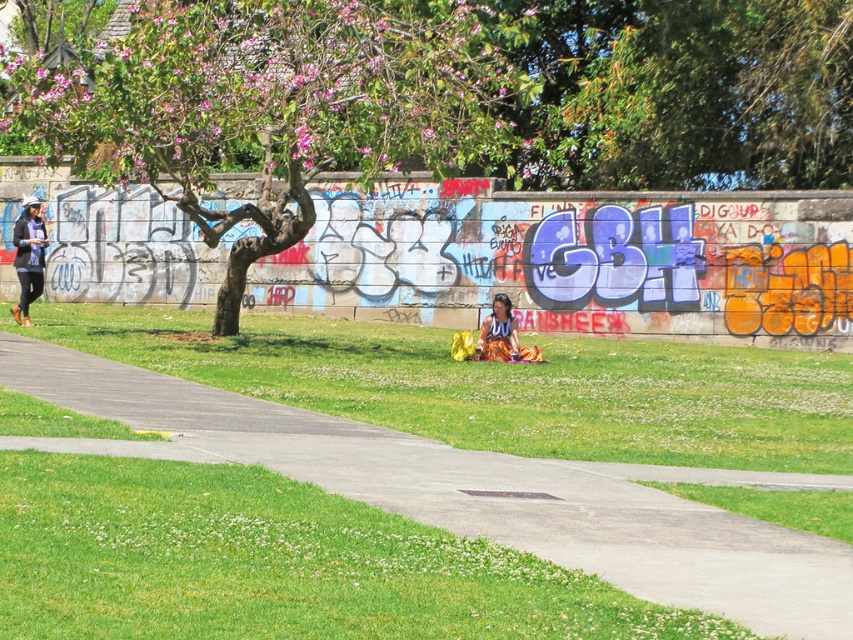
Who is taller, green grass at center or matte black jacket at left?

matte black jacket at left is taller.

The image size is (853, 640). What do you see at coordinates (502, 385) in the screenshot?
I see `green grass at center` at bounding box center [502, 385].

Does point (248, 381) lie in front of point (39, 291)?

That is True.

This screenshot has height=640, width=853. In order to click on green grass at center in this screenshot , I will do `click(502, 385)`.

Is gray concrete pavement at center positioned behind green grass at center?

No, it is in front of green grass at center.

Find the location of a particular element. The image size is (853, 640). gray concrete pavement at center is located at coordinates (474, 490).

Can you confirm if pink flowered tree at upper left is taller than gray concrete pavement at center?

Yes, pink flowered tree at upper left is taller than gray concrete pavement at center.

Is pink flowered tree at upper left to the left of gray concrete pavement at center from the viewer's perspective?

Correct, you'll find pink flowered tree at upper left to the left of gray concrete pavement at center.

Locate an element on the screen. pink flowered tree at upper left is located at coordinates (270, 106).